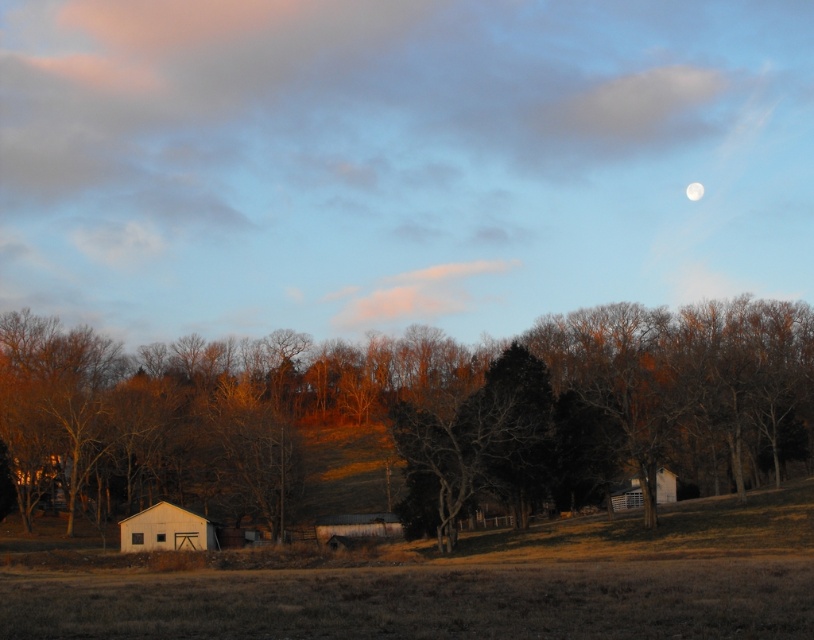
Can you confirm if white wooden barn at lower right is positioned above white smooth moon at upper right?

Actually, white wooden barn at lower right is below white smooth moon at upper right.

Who is lower down, white wooden barn at lower right or white smooth moon at upper right?

white wooden barn at lower right is lower down.

Which is behind, point (659, 480) or point (690, 189)?

The point (690, 189) is more distant.

Find the location of `white wooden barn at lower right`. white wooden barn at lower right is located at coordinates (628, 497).

Is brown matte tree at center below white matte barn at lower left?

No, brown matte tree at center is not below white matte barn at lower left.

Does point (241, 509) come farther from viewer compared to point (129, 536)?

Yes, it is behind point (129, 536).

Between point (37, 320) and point (145, 541), which one is positioned behind?

The point (37, 320) is behind.

This screenshot has height=640, width=814. Find the location of `brown matte tree at center`. brown matte tree at center is located at coordinates (414, 408).

Is white matte barn at lower left to the left of white smooth moon at upper right from the viewer's perspective?

Indeed, white matte barn at lower left is positioned on the left side of white smooth moon at upper right.

Is white matte barn at lower left further to camera compared to white smooth moon at upper right?

No, it is in front of white smooth moon at upper right.

Is point (182, 525) more distant than point (697, 196)?

No, it is in front of (697, 196).

Locate an element on the screen. white matte barn at lower left is located at coordinates (167, 529).